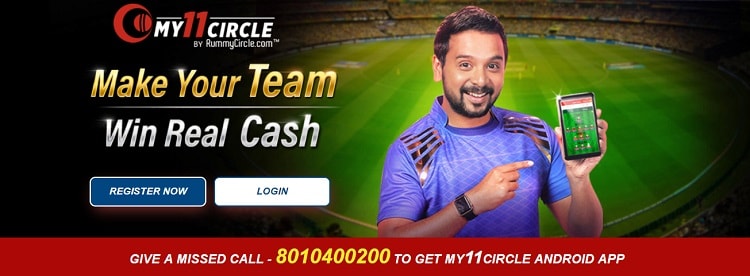
This screenshot has width=750, height=276. Identify the location of phone. (579, 127).